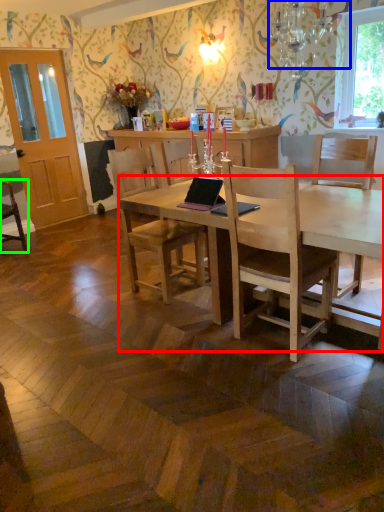
Question: Which object is positioned closest to desk (highlighted by a red box)? Select from lamp (highlighted by a blue box) and chair (highlighted by a green box).

Choices:
 (A) lamp
 (B) chair

Answer: (A)